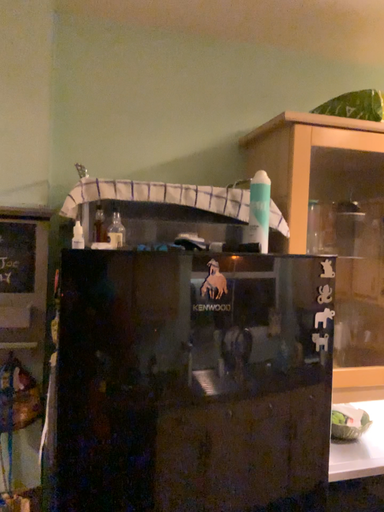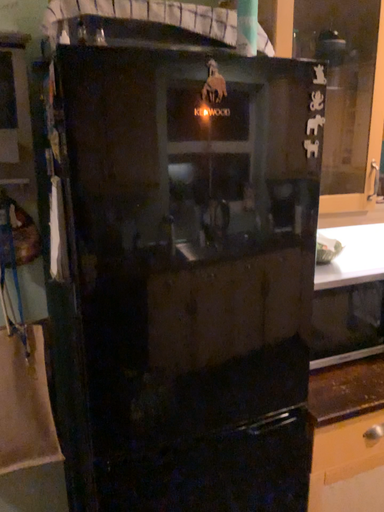
Question: Which way did the camera rotate in the video?

Choices:
 (A) rotated upward
 (B) rotated downward

Answer: (B)